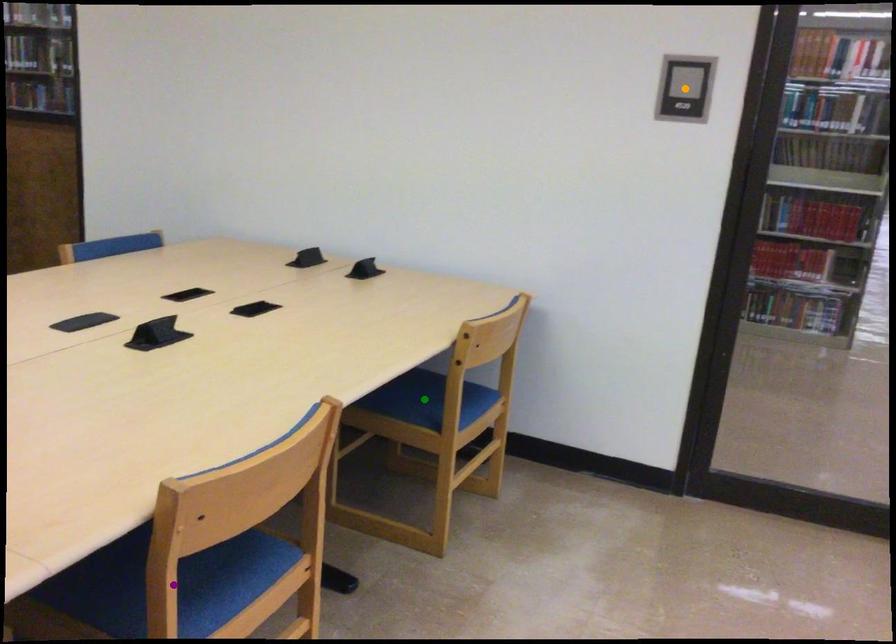
Order these from nearest to farthest:
A) green point
B) purple point
C) orange point

1. green point
2. orange point
3. purple point